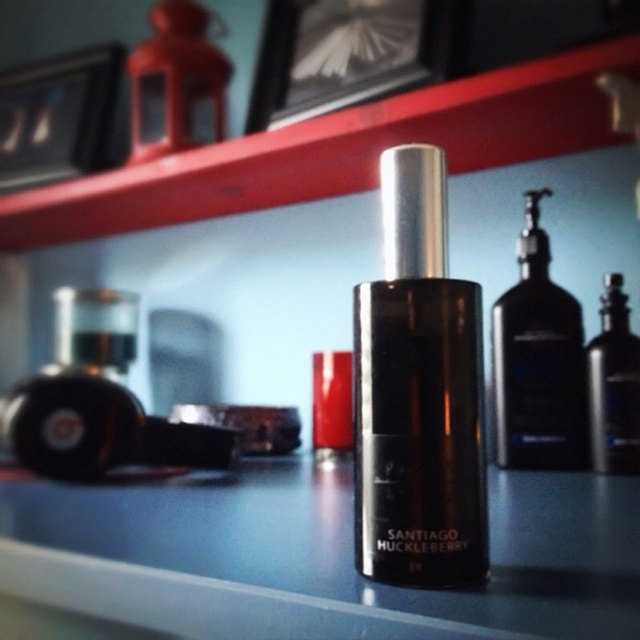
Does point (68, 225) come closer to viewer compared to point (332, 380)?

No, it is not.

Is matte black bottle at center smaller than matte red lipstick at center?

No, matte black bottle at center is not smaller than matte red lipstick at center.

Is point (381, 109) behind point (333, 396)?

No, (381, 109) is in front of (333, 396).

The image size is (640, 640). Identify the location of matte black bottle at center. (337, 150).

At what (x,y) coordinates should I click in order to perform the action: click on black matte bottle at center. Please return your answer as a coordinate pair (x, y). The height and width of the screenshot is (640, 640). Looking at the image, I should click on (538, 362).

Between point (540, 301) and point (611, 333), which one is positioned in front?

Point (611, 333) is in front.

Is point (524, 268) positioned behind point (637, 417)?

Yes, point (524, 268) is farther from viewer.

Identify the location of black matte bottle at center. The width and height of the screenshot is (640, 640). (538, 362).

Is point (65, 152) positioned in front of point (323, 440)?

No, (65, 152) is behind (323, 440).

Can you confirm if wooden picture frame at upper left is positioned above matte red lipstick at center?

Correct, wooden picture frame at upper left is located above matte red lipstick at center.

Find the location of a particular element. wooden picture frame at upper left is located at coordinates (56, 115).